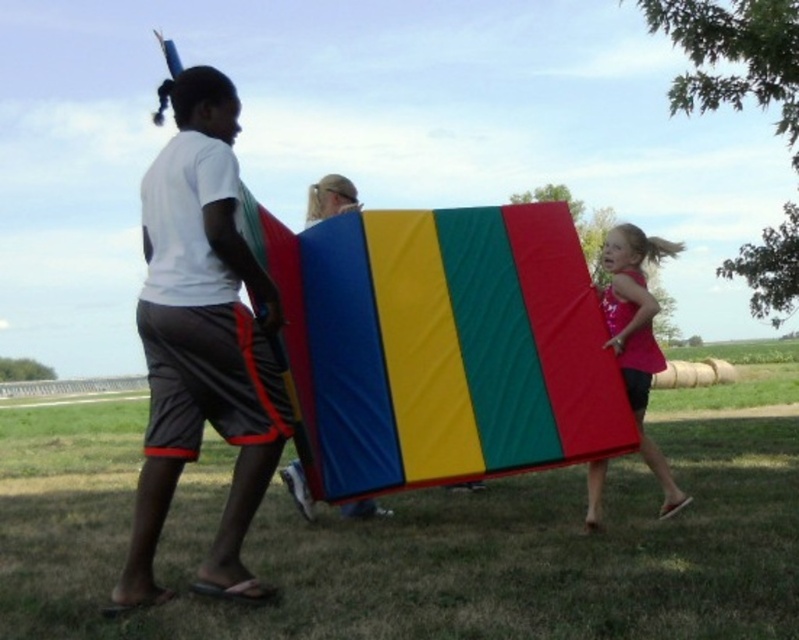
Question: Which point is closer to the camera taking this photo?

Choices:
 (A) (201, 198)
 (B) (291, 486)
 (C) (418, 234)
 (D) (630, 376)

Answer: (A)

Question: Which object is the farthest from the matte fabric board at center?

Choices:
 (A) textured fabric parachute at center
 (B) pink fabric dress at right
 (C) white matte t-shirt at left

Answer: (B)

Question: In this image, where is textured fabric parachute at center located relative to white matte t-shirt at left?

Choices:
 (A) left
 (B) right

Answer: (B)

Question: Is white matte t-shirt at left to the left of pink fabric dress at right from the viewer's perspective?

Choices:
 (A) yes
 (B) no

Answer: (A)

Question: Which of the following is the farthest from the observer?

Choices:
 (A) matte fabric board at center
 (B) pink fabric dress at right
 (C) textured fabric parachute at center
 (D) white matte t-shirt at left

Answer: (A)

Question: Does white matte t-shirt at left have a greater width compared to matte fabric board at center?

Choices:
 (A) yes
 (B) no

Answer: (A)